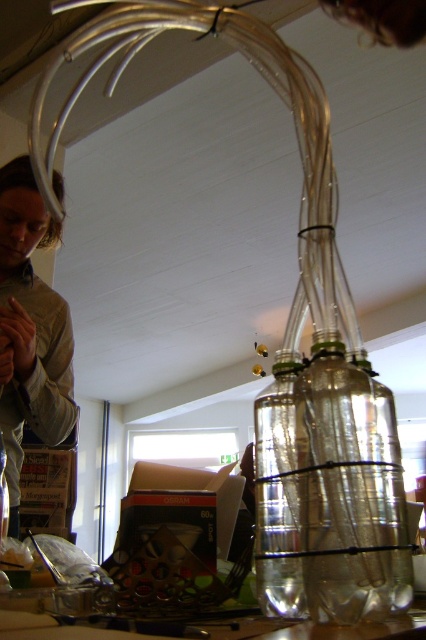
Question: Does matte brown hair at upper left appear over clear glass bottle at center?

Choices:
 (A) no
 (B) yes

Answer: (B)

Question: In this image, where is matte brown hair at upper left located relative to clear glass bottle at center?

Choices:
 (A) above
 (B) below

Answer: (A)

Question: Which of these objects is positioned closest to the matte brown hair at upper left?

Choices:
 (A) transparent plastic bottles at center
 (B) clear glass bottle at center

Answer: (B)

Question: Which of the following is the closest to the observer?

Choices:
 (A) (287, 490)
 (B) (20, 464)
 (C) (308, 566)

Answer: (C)

Question: Does transparent plastic bottles at center lie behind matte brown hair at upper left?

Choices:
 (A) yes
 (B) no

Answer: (B)

Question: Which object is farther from the camera taking this photo?

Choices:
 (A) transparent plastic bottles at center
 (B) matte brown hair at upper left

Answer: (B)